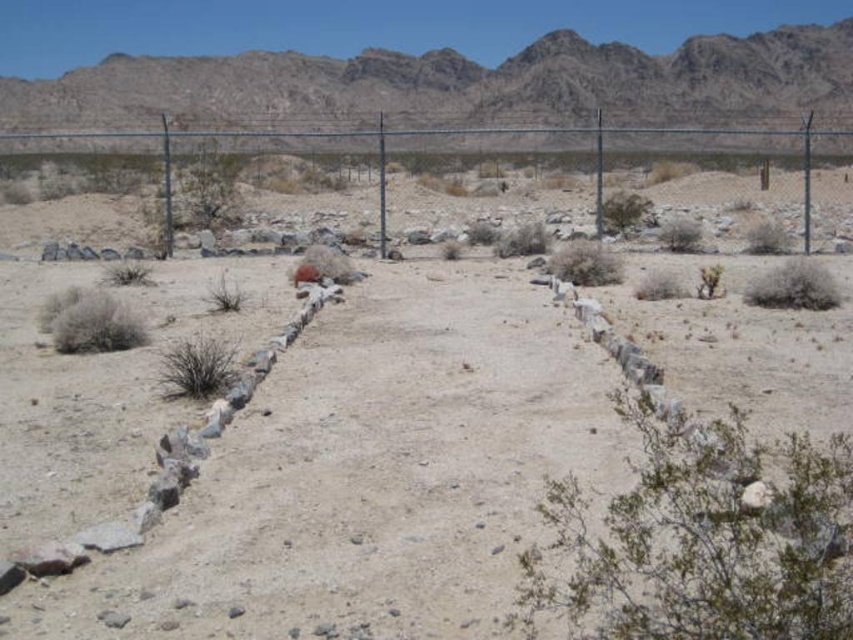
Question: Among these points, which one is nearest to the camera?

Choices:
 (A) (556, 90)
 (B) (271, 547)
 (C) (264, 131)

Answer: (B)

Question: Is dull gray dirt field at center to the left of rugged rock mountain at upper center from the viewer's perspective?

Choices:
 (A) no
 (B) yes

Answer: (B)

Question: Can you confirm if dull gray dirt field at center is thinner than rugged rock mountain at upper center?

Choices:
 (A) yes
 (B) no

Answer: (A)

Question: Which object is the farthest from the rugged rock mountain at upper center?

Choices:
 (A) dull gray dirt field at center
 (B) metallic chain-link fence at upper left

Answer: (A)

Question: Which of the following is the farthest from the observer?

Choices:
 (A) dull gray dirt field at center
 (B) rugged rock mountain at upper center
 (C) metallic chain-link fence at upper left

Answer: (B)

Question: Is the position of dull gray dirt field at center more distant than that of rugged rock mountain at upper center?

Choices:
 (A) no
 (B) yes

Answer: (A)